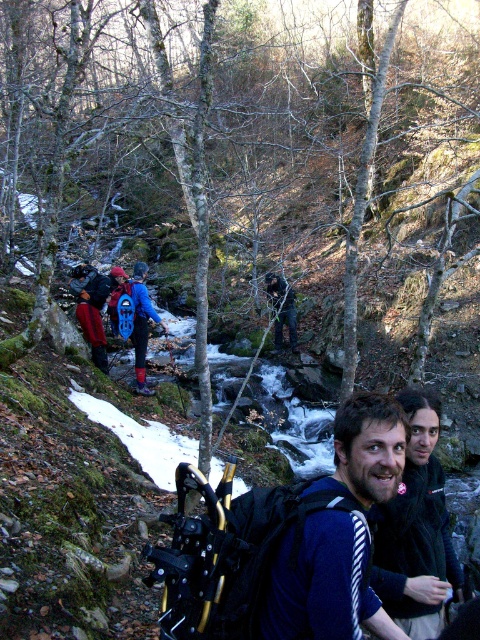
You are standing at the point marked as point (361,568) in the forest scene. A hiker wants to throw a stick to their dog, which is 2 meters away from them. Can they reach their dog with the throw?

The distance of point (361,568) from viewer is 1.85 meters. Since the dog is 2 meters away, the hiker is too far to reach the dog with the throw.

You are a hiker trying to identify which clothing item is nearer to you in the scene. You see a blue striped sweater at center and a blue waterproof jacket at center. Which one is closer?

The blue striped sweater at center is closer to the viewer than the blue waterproof jacket at center.